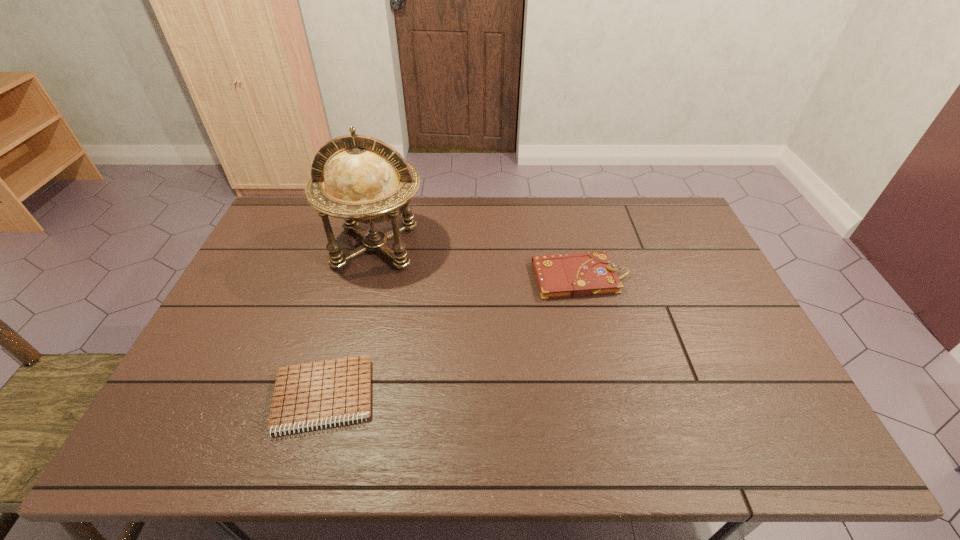
Find the location of `free area in between the farther notebook and the shorter notebook`. free area in between the farther notebook and the shorter notebook is located at coordinates (452, 337).

This screenshot has width=960, height=540. What are the coordinates of `free space between the nearest object and the second shortest object` in the screenshot? It's located at (452, 337).

You are a GUI agent. You are given a task and a screenshot of the screen. Output one action in this format:
    pyautogui.click(x=<x>, y=<y>)
    Task: Click on the free spot between the second tallest object and the tallest object
    
    Given the screenshot: What is the action you would take?
    pyautogui.click(x=479, y=261)

Locate an element on the screen. unoccupied position between the shortest object and the taller notebook is located at coordinates (452, 337).

This screenshot has height=540, width=960. In order to click on vacant space in between the nearest object and the second tallest object in this screenshot , I will do `click(452, 337)`.

Locate an element on the screen. The image size is (960, 540). vacant space that's between the right notebook and the nearer notebook is located at coordinates (452, 337).

Identify which object is the second closest to the shortest object. Please provide its 2D coordinates. Your answer should be formatted as a tuple, i.e. [(x, y)], where the tuple contains the x and y coordinates of a point satisfying the conditions above.

[(583, 274)]

The height and width of the screenshot is (540, 960). I want to click on the closest object to the farther notebook, so click(x=367, y=181).

Locate an element on the screen. free spot that satisfies the following two spatial constraints: 1. on the front-facing side of the tallest object; 2. on the right side of the second tallest object is located at coordinates (368, 278).

You are a GUI agent. You are given a task and a screenshot of the screen. Output one action in this format:
    pyautogui.click(x=<x>, y=<y>)
    Task: Click on the vacant space that satisfies the following two spatial constraints: 1. on the front-facing side of the second tallest object; 2. on the right side of the tallest object
    
    Given the screenshot: What is the action you would take?
    pyautogui.click(x=368, y=278)